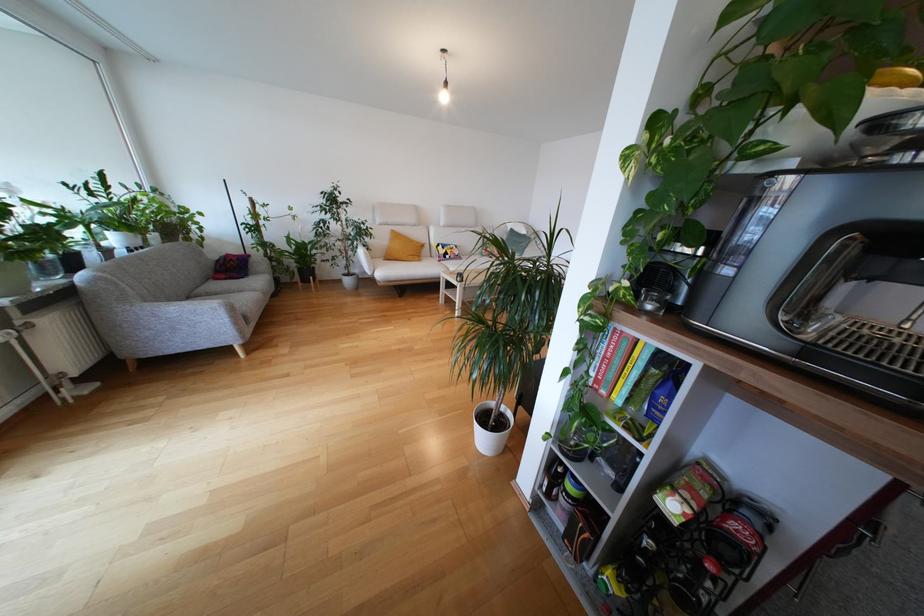
What do you see at coordinates (225, 289) in the screenshot? I see `the grey sofa armrest` at bounding box center [225, 289].